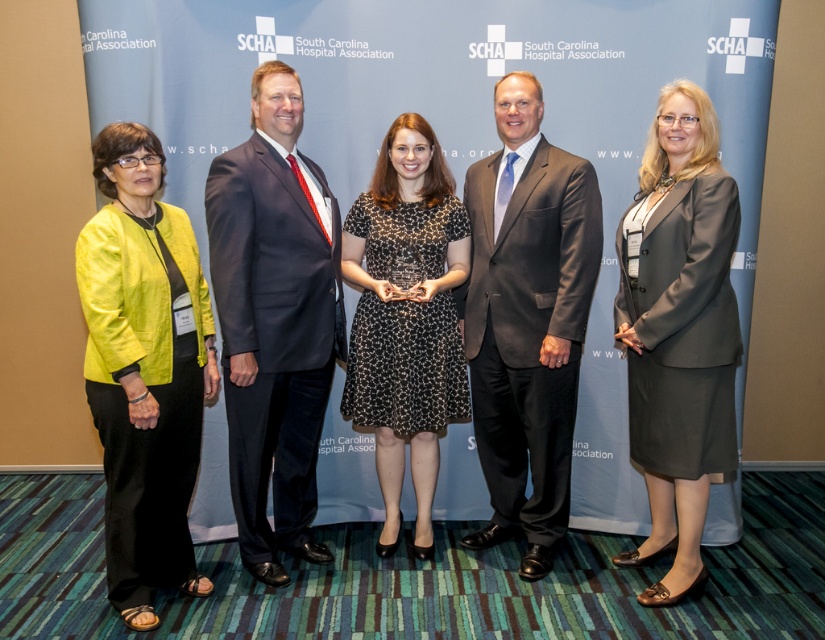
Is matte yellow blazer at left to the right of dark gray suit at center from the viewer's perspective?

Incorrect, matte yellow blazer at left is not on the right side of dark gray suit at center.

Is matte yellow blazer at left below dark gray suit at center?

Indeed, matte yellow blazer at left is positioned under dark gray suit at center.

Is point (121, 150) positioned behind point (517, 408)?

That is False.

Locate an element on the screen. The width and height of the screenshot is (825, 640). matte yellow blazer at left is located at coordinates (144, 369).

Who is lower down, dark blue suit at center or dark gray suit at center?

dark blue suit at center is below.

Is point (248, 410) positioned in front of point (569, 211)?

Yes, point (248, 410) is closer to viewer.

What do you see at coordinates (274, 321) in the screenshot? I see `dark blue suit at center` at bounding box center [274, 321].

Where is `dark blue suit at center`? dark blue suit at center is located at coordinates (274, 321).

Does dark blue suit at center have a greater height compared to matte gray suit at right?

Correct, dark blue suit at center is much taller as matte gray suit at right.

Does dark blue suit at center appear under matte gray suit at right?

Incorrect, dark blue suit at center is not positioned below matte gray suit at right.

Does point (229, 381) lie in front of point (684, 301)?

That is False.

Locate an element on the screen. The height and width of the screenshot is (640, 825). dark blue suit at center is located at coordinates (274, 321).